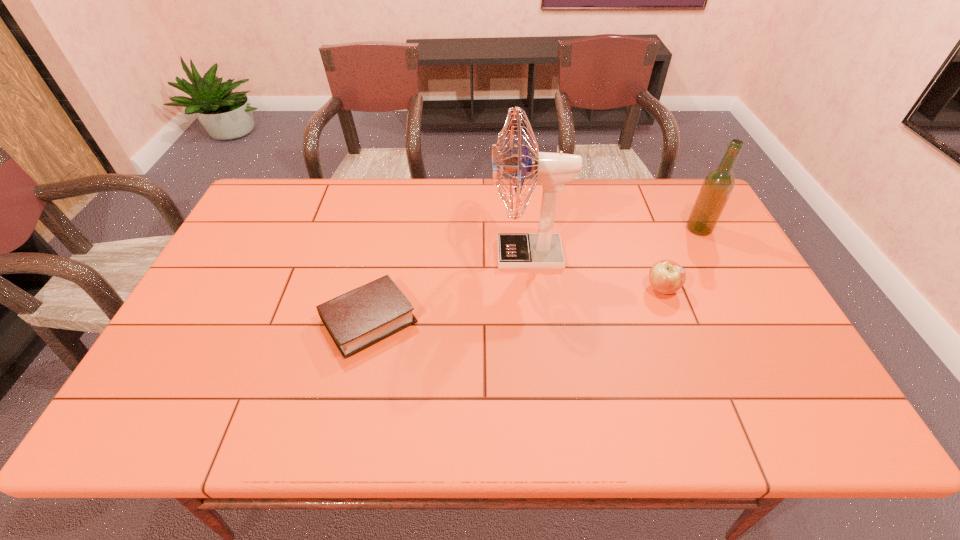
Where is `empty location between the leftmost object and the rightmost object`? The width and height of the screenshot is (960, 540). empty location between the leftmost object and the rightmost object is located at coordinates (534, 274).

Locate an element on the screen. free space between the third shortest object and the second object from right to left is located at coordinates (681, 259).

You are a GUI agent. You are given a task and a screenshot of the screen. Output one action in this format:
    pyautogui.click(x=<x>, y=<y>)
    Task: Click on the blank region between the liquor and the third object from left to right
    This screenshot has height=540, width=960.
    Given the screenshot: What is the action you would take?
    pyautogui.click(x=681, y=259)

I want to click on object that stands as the closest to the third shortest object, so click(666, 277).

In order to click on object that ranks as the closest to the rightmost object in this screenshot , I will do `click(666, 277)`.

Find the location of a particular element. The height and width of the screenshot is (540, 960). vacant space that satisfies the following two spatial constraints: 1. on the back side of the apple; 2. on the front-facing side of the tallest object is located at coordinates (649, 254).

This screenshot has width=960, height=540. Find the location of `blank space that satisfies the following two spatial constraints: 1. on the front-facing side of the third object from right to left; 2. on the front side of the leftmost object`. blank space that satisfies the following two spatial constraints: 1. on the front-facing side of the third object from right to left; 2. on the front side of the leftmost object is located at coordinates (535, 320).

Where is `blank space that satisfies the following two spatial constraints: 1. on the front-facing side of the fan; 2. on the right side of the third object from left to right`? blank space that satisfies the following two spatial constraints: 1. on the front-facing side of the fan; 2. on the right side of the third object from left to right is located at coordinates (531, 289).